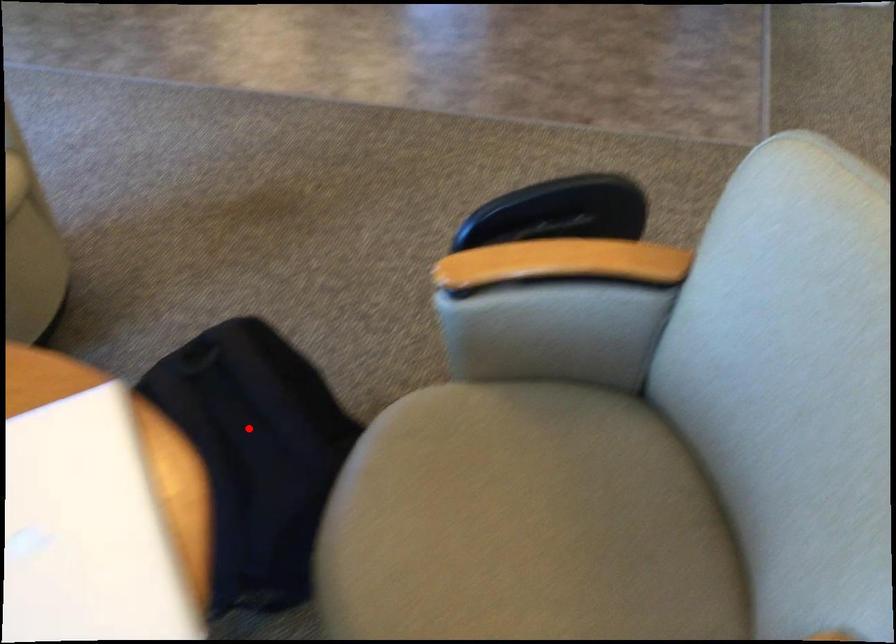
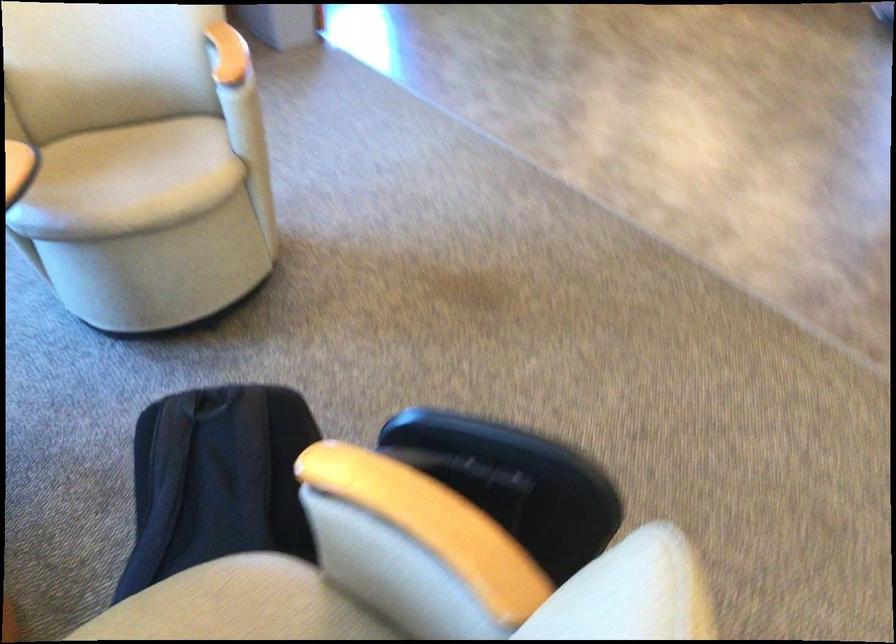
In the second image, find the point that corresponds to the highlighted location in the first image.

(217, 480)